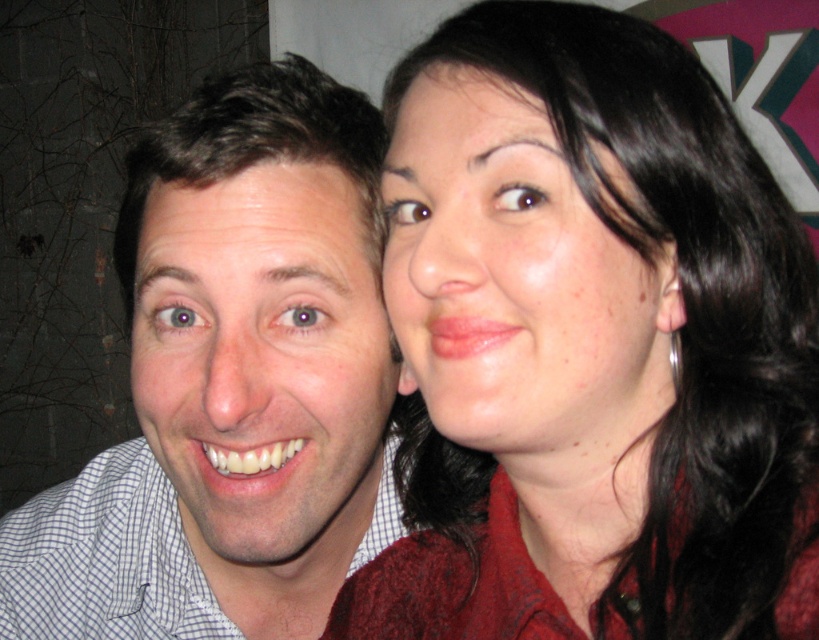
You are a photographer trying to adjust the lighting for a portrait. You notice the matte red sweater at upper right and the matte skin face at upper right in the frame. Which object should you focus on if you want to highlight the taller one in the scene?

The matte red sweater at upper right is taller than the matte skin face at upper right, so you should focus on the matte red sweater at upper right to highlight the taller object.

You are a photographer adjusting the focus of your camera. The camera has a depth of field that can clearly capture objects within 8 inches. Can you focus on both the white matte face at center and the silver metallic ring at ear simultaneously?

The white matte face at center is 8.30 inches away from the silver metallic ring at ear. Since the distance between them is slightly more than 8 inches, the camera cannot focus on both simultaneously within the depth of field range.

You are taking a photo of two people standing at point (281, 161). The camera is 18.35 inches away from this point. If the camera has a focal length of 50mm, what is the approximate magnification of the image?

The magnification can be calculated using the formula magnification equals focal length divided by distance. Plugging in the values, magnification equals 50mm divided by 18.35 inches. Converting inches to millimeters, 18.35 inches is approximately 466mm. Thus, magnification equals 50 divided by 466, resulting in approximately 0.107, or 10.7 percent magnification.